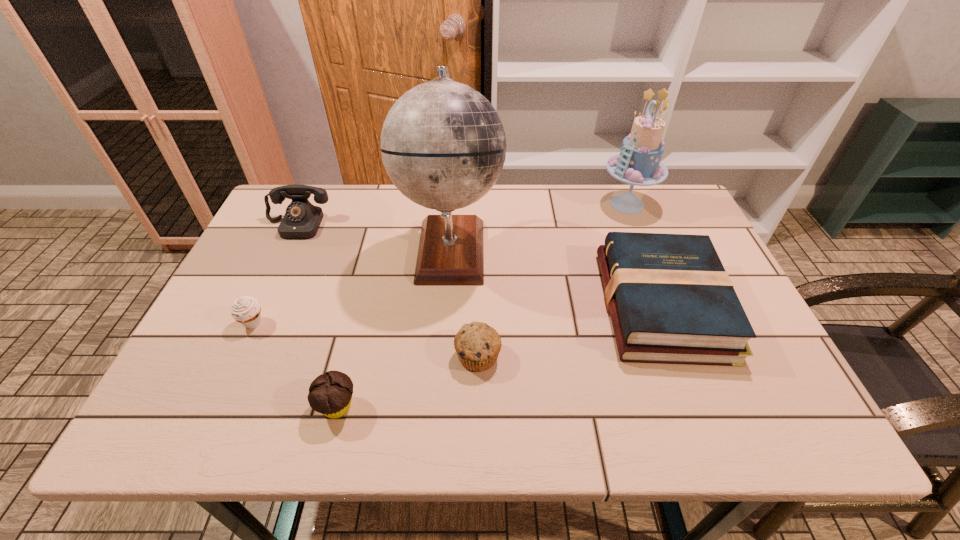
The width and height of the screenshot is (960, 540). In order to click on vacant area that satisfies the following two spatial constraints: 1. at the equator of the globe; 2. on the left side of the hardback book in this screenshot , I will do `click(446, 305)`.